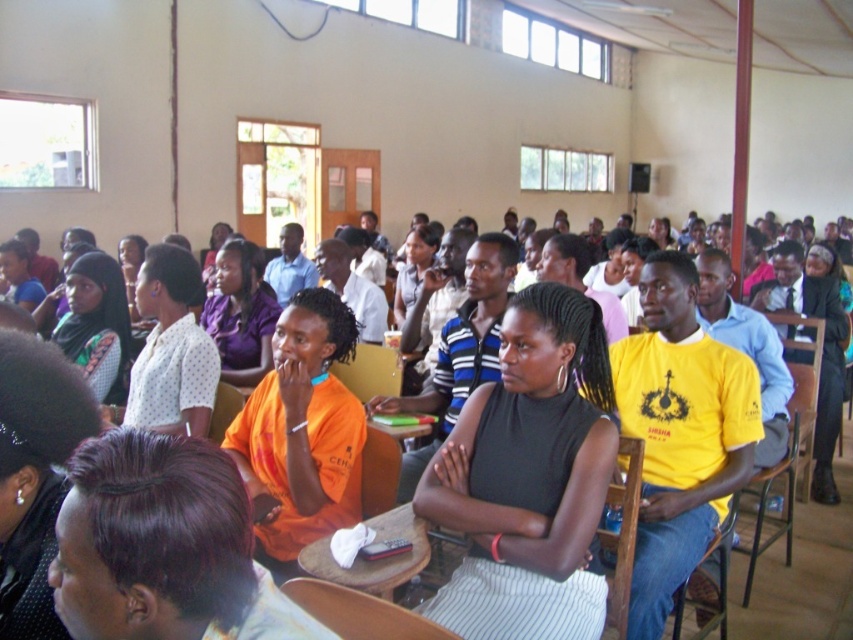
Question: Which object is farther from the camera taking this photo?

Choices:
 (A) black matte dress at center
 (B) wooden chair at lower right
 (C) orange matte shirt at center

Answer: (C)

Question: Considering the real-world distances, which object is closest to the black matte dress at center?

Choices:
 (A) orange matte shirt at center
 (B) dark purple hair at center
 (C) wooden chair at lower right

Answer: (C)

Question: Among these points, which one is farthest from the camera?

Choices:
 (A) (53, 413)
 (B) (228, 636)
 (C) (630, 465)

Answer: (C)

Question: Does wooden chair at center have a smaller size compared to orange fabric chair at center?

Choices:
 (A) yes
 (B) no

Answer: (A)

Question: In this image, where is orange matte shirt at center located relative to purple matte shirt at center?

Choices:
 (A) below
 (B) above

Answer: (A)

Question: Can you confirm if black matte dress at center is positioned to the left of orange matte shirt at center?

Choices:
 (A) no
 (B) yes

Answer: (A)